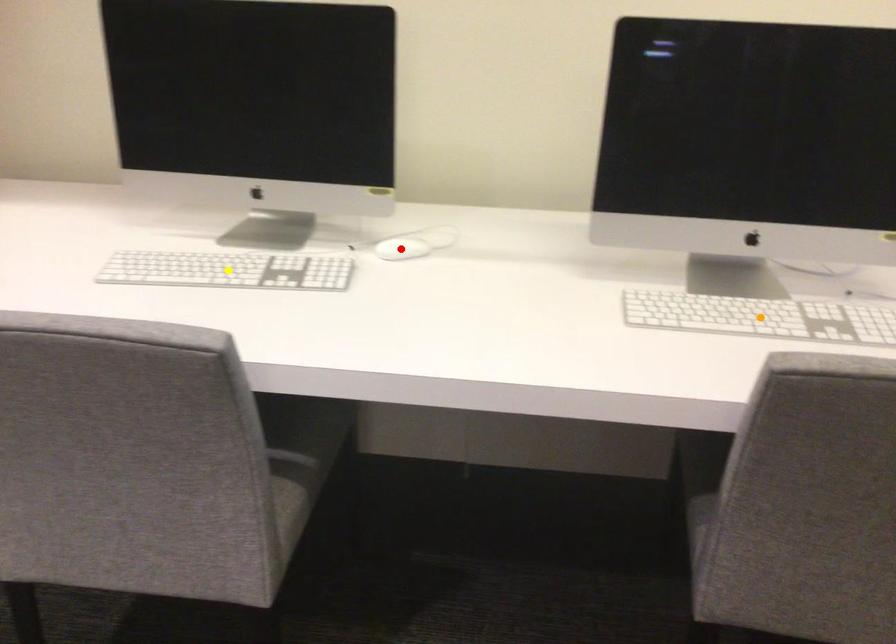
Consider the image. Order these from nearest to farthest:
A) yellow point
B) red point
C) orange point

1. red point
2. yellow point
3. orange point